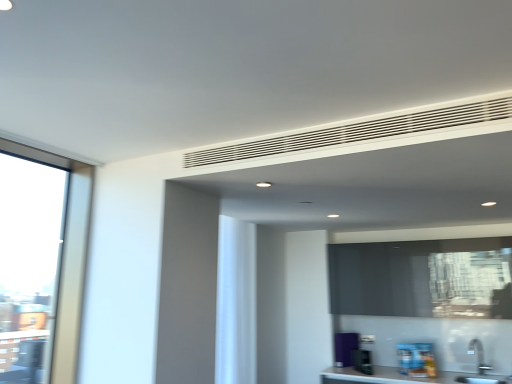
Question: Can you see green plastic toaster at lower center, the second appliance in the right-to-left sequence, touching black matte window screen at center?

Choices:
 (A) yes
 (B) no

Answer: (B)

Question: Is green plastic toaster at lower center, positioned as the 2th appliance in back-to-front order, outside black matte window screen at center?

Choices:
 (A) yes
 (B) no

Answer: (A)

Question: Is green plastic toaster at lower center, acting as the 2th appliance starting from the left, positioned before black matte window screen at center?

Choices:
 (A) yes
 (B) no

Answer: (B)

Question: Is green plastic toaster at lower center, marked as the second appliance in a front-to-back arrangement, not close to black matte window screen at center?

Choices:
 (A) yes
 (B) no

Answer: (B)

Question: Is black matte window screen at center at the back of green plastic toaster at lower center, marked as the second appliance in a front-to-back arrangement?

Choices:
 (A) yes
 (B) no

Answer: (B)

Question: Based on their positions, is purple matte refrigerator at lower right, which ranks as the 3th appliance in right-to-left order, located to the left or right of green plastic toaster at lower center, marked as the second appliance in a front-to-back arrangement?

Choices:
 (A) right
 (B) left

Answer: (B)

Question: From a real-world perspective, is purple matte refrigerator at lower right, which ranks as the 3th appliance in right-to-left order, physically located above or below green plastic toaster at lower center, marked as the second appliance in a front-to-back arrangement?

Choices:
 (A) below
 (B) above

Answer: (B)

Question: In terms of size, does purple matte refrigerator at lower right, which ranks as the 3th appliance in right-to-left order, appear bigger or smaller than green plastic toaster at lower center, marked as the second appliance in a front-to-back arrangement?

Choices:
 (A) small
 (B) big

Answer: (B)

Question: In the image, is purple matte refrigerator at lower right, which ranks as the 3th appliance in right-to-left order, positioned in front of or behind green plastic toaster at lower center, acting as the 2th appliance starting from the left?

Choices:
 (A) behind
 (B) front

Answer: (A)

Question: From the image's perspective, is white matte curtain at center positioned above or below white matte vent at upper center?

Choices:
 (A) below
 (B) above

Answer: (A)

Question: Choose the correct answer: Is white matte curtain at center inside white matte vent at upper center or outside it?

Choices:
 (A) inside
 (B) outside

Answer: (B)

Question: Considering the positions of point [x=247, y=228] and point [x=215, y=160], is point [x=247, y=228] closer or farther from the camera than point [x=215, y=160]?

Choices:
 (A) closer
 (B) farther

Answer: (B)

Question: Looking at their shapes, would you say white matte curtain at center is wider or thinner than white matte vent at upper center?

Choices:
 (A) wide
 (B) thin

Answer: (A)

Question: Looking at their shapes, would you say white matte curtain at center is wider or thinner than blue glossy book at lower right, which is the 1th appliance from right to left?

Choices:
 (A) wide
 (B) thin

Answer: (A)

Question: From the image's perspective, is white matte curtain at center above or below blue glossy book at lower right, which is the first appliance from front to back?

Choices:
 (A) above
 (B) below

Answer: (A)